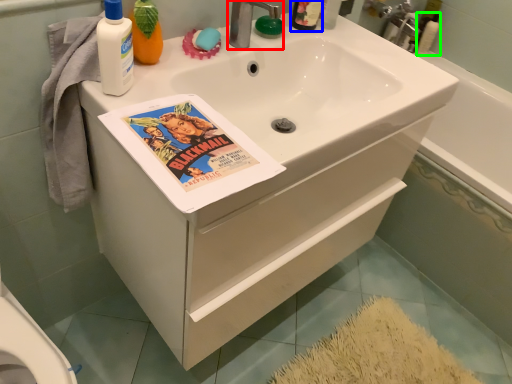
Question: Which object is the closest to the tap (highlighted by a red box)? Choose among these: mouthwash (highlighted by a blue box) or cleaning product (highlighted by a green box).

Choices:
 (A) mouthwash
 (B) cleaning product

Answer: (A)